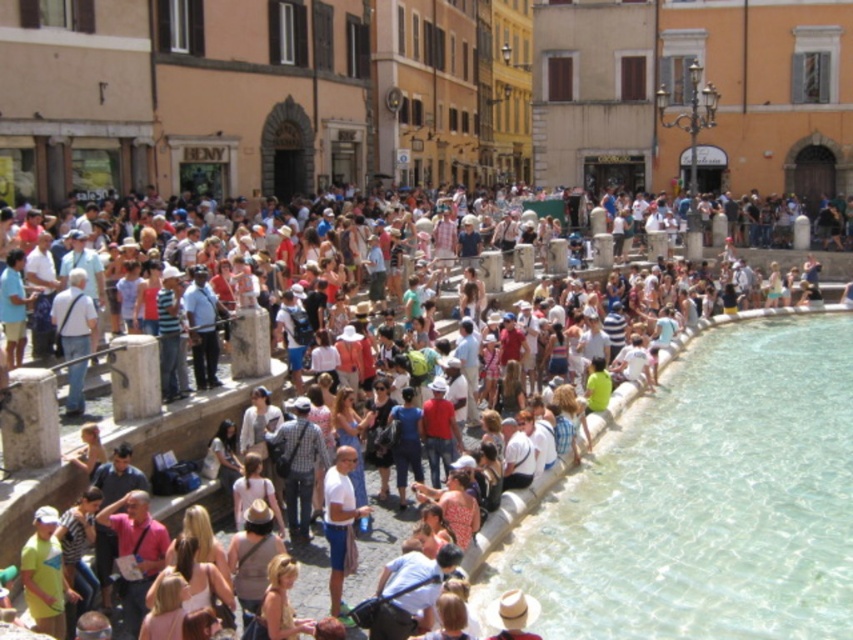
You are a tour guide leading a group through the plaza. You want to point out both the clear stone pool at lower right and the matte stone crowd at center. Which object is closer to the tourists in your group?

The clear stone pool at lower right is closer to the tourists because it is positioned further to the viewer than the matte stone crowd at center, which is located behind it.

You are a tour guide leading a group through the plaza. You need to move your group from the entrance to the clear stone pool at lower right. The path goes through the matte stone crowd at center. Considering the width of the path, will your group be able to pass through the crowd without splitting into smaller groups?

The clear stone pool at lower right is thinner than the matte stone crowd at center, so the path through the matte stone crowd at center is wider than the pool itself. However, since the crowd is at the center, it might be denser, making it difficult to pass through without splitting the group. The width of the path is sufficient, but the crowd density could be an issue.